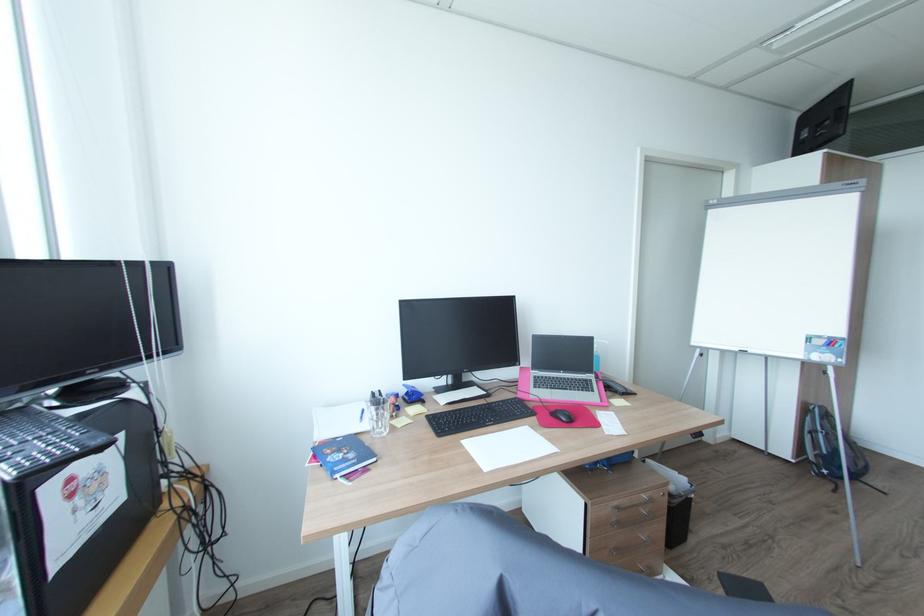
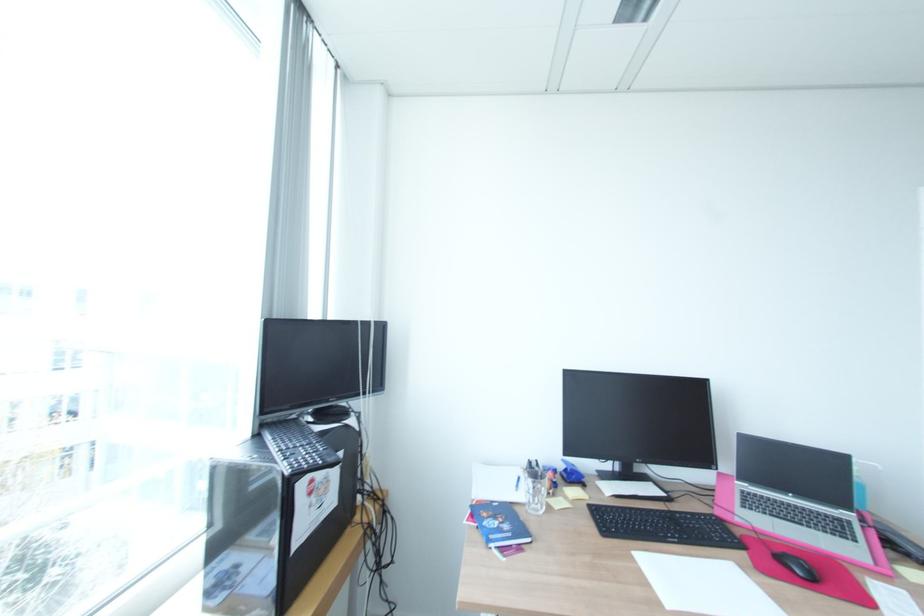
In the second image, find the point that corresponds to [349,460] in the first image.

(504, 530)